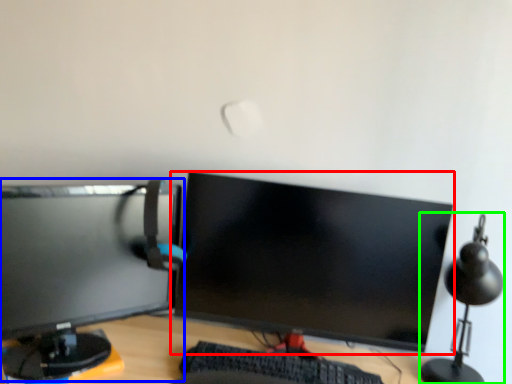
Question: Based on their relative distances, which object is nearer to computer monitor (highlighted by a red box)? Choose from computer monitor (highlighted by a blue box) and table lamp (highlighted by a green box).

Choices:
 (A) computer monitor
 (B) table lamp

Answer: (A)